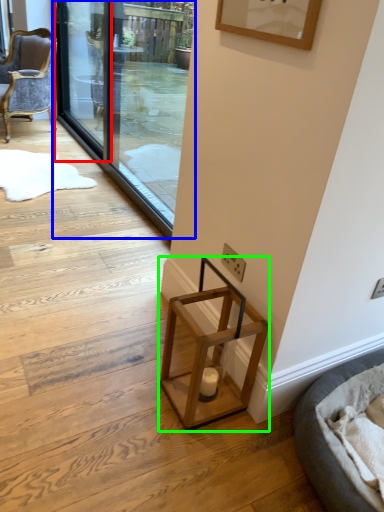
Question: Based on their relative distances, which object is nearer to screen door (highlighted by a red box)? Choose from screen door (highlighted by a blue box) and stool (highlighted by a green box).

Choices:
 (A) screen door
 (B) stool

Answer: (A)